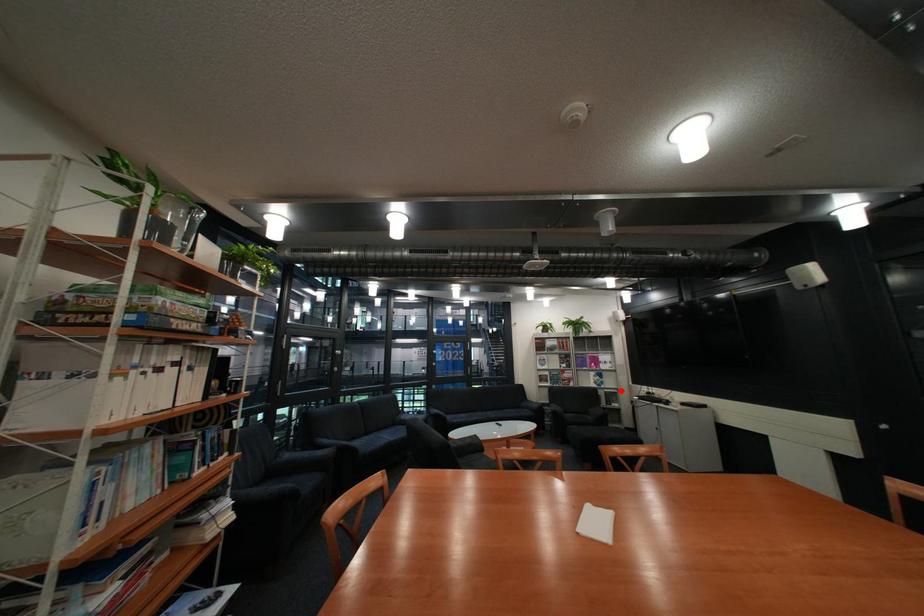
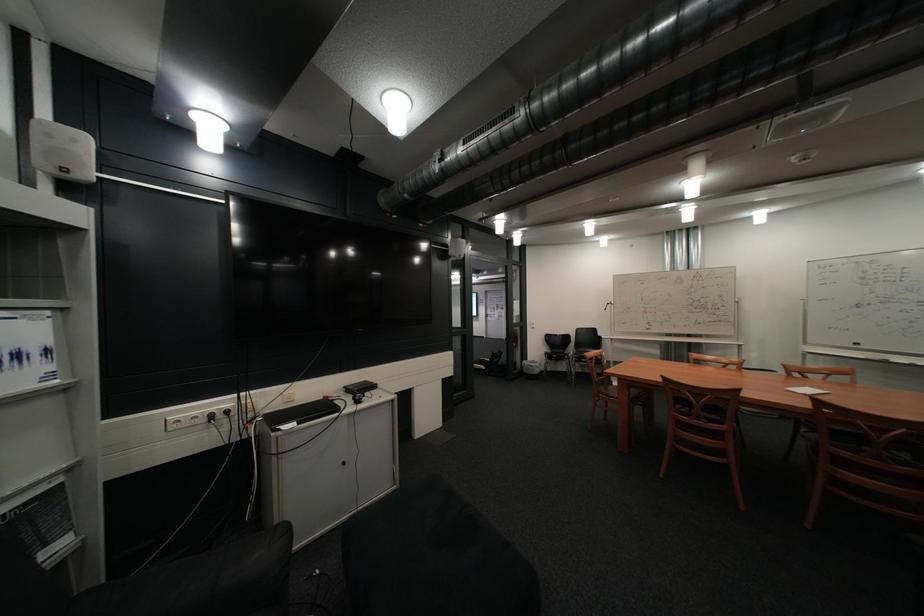
Question: I am providing you with two images of the same scene from different viewpoints. A red point is marked on the first image. At the location where the point appears in image 1, is it still visible in image 2?

Choices:
 (A) Yes
 (B) No

Answer: (A)